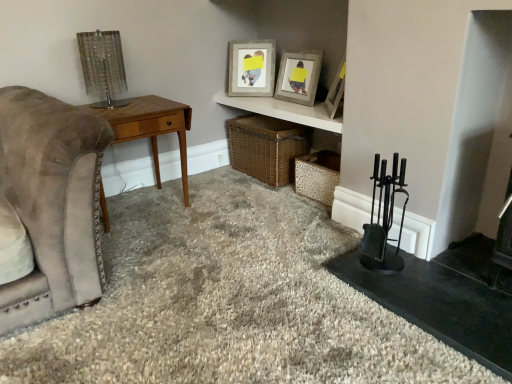
Question: From the image's perspective, is wooden picture frame at upper center, the second picture frame in the left-to-right sequence, on top of metallic textured crate at lower right, which is the 1th crate in right-to-left order?

Choices:
 (A) yes
 (B) no

Answer: (A)

Question: Is wooden picture frame at upper center, the second picture frame in the left-to-right sequence, wider than metallic textured crate at lower right, arranged as the 2th crate when viewed from the left?

Choices:
 (A) no
 (B) yes

Answer: (A)

Question: Is wooden picture frame at upper center, the second picture frame in the left-to-right sequence, oriented away from metallic textured crate at lower right, which is the 1th crate in right-to-left order?

Choices:
 (A) yes
 (B) no

Answer: (B)

Question: Is wooden picture frame at upper center, placed as the second picture frame when sorted from right to left, positioned before metallic textured crate at lower right, arranged as the 2th crate when viewed from the left?

Choices:
 (A) yes
 (B) no

Answer: (B)

Question: Is metallic textured crate at lower right, arranged as the 2th crate when viewed from the left, surrounded by wooden picture frame at upper center, the second picture frame in the left-to-right sequence?

Choices:
 (A) yes
 (B) no

Answer: (B)

Question: Is wooden picture frame at upper center, which ranks as the third picture frame in left-to-right order, taller or shorter than matte wooden shelf at upper center?

Choices:
 (A) short
 (B) tall

Answer: (B)

Question: Would you say wooden picture frame at upper center, which appears as the first picture frame when viewed from the right, is to the left or to the right of matte wooden shelf at upper center in the picture?

Choices:
 (A) left
 (B) right

Answer: (B)

Question: Based on their sizes in the image, would you say wooden picture frame at upper center, which ranks as the third picture frame in left-to-right order, is bigger or smaller than matte wooden shelf at upper center?

Choices:
 (A) big
 (B) small

Answer: (B)

Question: From the image's perspective, is wooden picture frame at upper center, which ranks as the third picture frame in left-to-right order, positioned above or below matte wooden shelf at upper center?

Choices:
 (A) above
 (B) below

Answer: (A)

Question: In the image, is matte wooden shelf at upper center on the left side or the right side of wooden picture frame at upper center, which is counted as the first picture frame, starting from the left?

Choices:
 (A) right
 (B) left

Answer: (A)

Question: Considering the positions of point (252, 97) and point (244, 41), is point (252, 97) closer or farther from the camera than point (244, 41)?

Choices:
 (A) closer
 (B) farther

Answer: (A)

Question: Based on their sizes in the image, would you say matte wooden shelf at upper center is bigger or smaller than wooden picture frame at upper center, the 3th picture frame viewed from the right?

Choices:
 (A) big
 (B) small

Answer: (A)

Question: In terms of width, does matte wooden shelf at upper center look wider or thinner when compared to wooden picture frame at upper center, which is counted as the first picture frame, starting from the left?

Choices:
 (A) thin
 (B) wide

Answer: (B)

Question: Choose the correct answer: Is metallic textured crate at lower right, arranged as the 2th crate when viewed from the left, inside metallic mesh lamp at upper left or outside it?

Choices:
 (A) outside
 (B) inside

Answer: (A)

Question: In terms of height, does metallic textured crate at lower right, which is the 1th crate in right-to-left order, look taller or shorter compared to metallic mesh lamp at upper left?

Choices:
 (A) tall
 (B) short

Answer: (B)